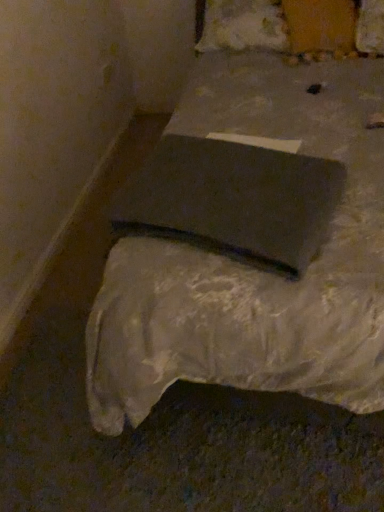
Question: Is matte gray bed at center wider than matte gray pad at center?

Choices:
 (A) yes
 (B) no

Answer: (A)

Question: Is matte gray bed at center oriented towards matte gray pad at center?

Choices:
 (A) yes
 (B) no

Answer: (A)

Question: Would you say matte gray bed at center is a long distance from matte gray pad at center?

Choices:
 (A) yes
 (B) no

Answer: (B)

Question: Does matte gray bed at center have a lesser height compared to matte gray pad at center?

Choices:
 (A) no
 (B) yes

Answer: (A)

Question: From the image's perspective, is matte gray bed at center under matte gray pad at center?

Choices:
 (A) yes
 (B) no

Answer: (B)

Question: Is matte gray bed at center at the right side of matte gray pad at center?

Choices:
 (A) yes
 (B) no

Answer: (A)

Question: From the image's perspective, would you say matte gray pad at center is shown under matte gray bed at center?

Choices:
 (A) yes
 (B) no

Answer: (A)

Question: Is matte gray pad at center oriented towards matte gray bed at center?

Choices:
 (A) yes
 (B) no

Answer: (A)

Question: Is matte gray pad at center looking in the opposite direction of matte gray bed at center?

Choices:
 (A) no
 (B) yes

Answer: (B)

Question: Considering the relative sizes of matte gray pad at center and matte gray bed at center in the image provided, is matte gray pad at center taller than matte gray bed at center?

Choices:
 (A) no
 (B) yes

Answer: (A)

Question: Are matte gray pad at center and matte gray bed at center far apart?

Choices:
 (A) yes
 (B) no

Answer: (B)

Question: From a real-world perspective, is matte gray pad at center over matte gray bed at center?

Choices:
 (A) no
 (B) yes

Answer: (B)

Question: Considering the relative sizes of white cotton pillow at upper center and matte gray bed at center in the image provided, is white cotton pillow at upper center thinner than matte gray bed at center?

Choices:
 (A) no
 (B) yes

Answer: (B)